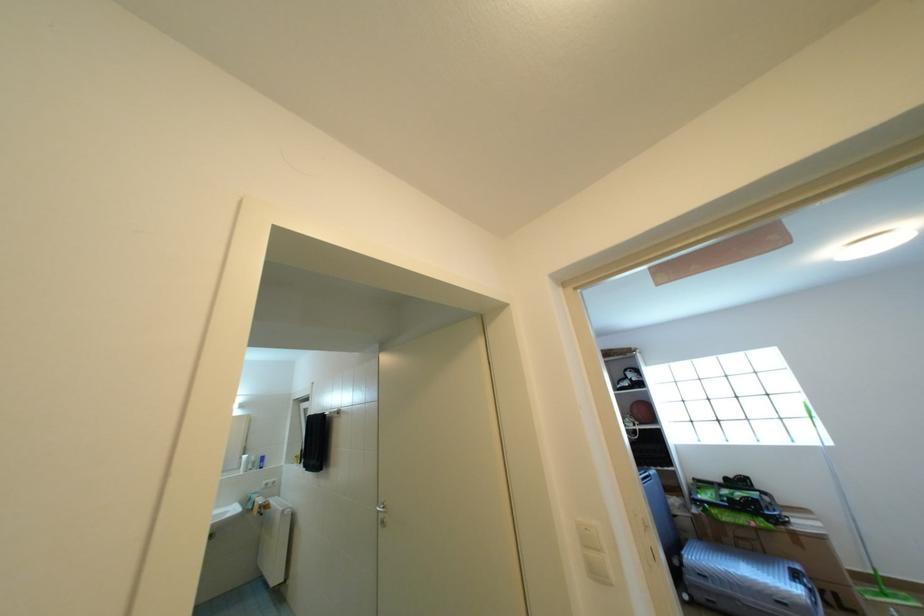
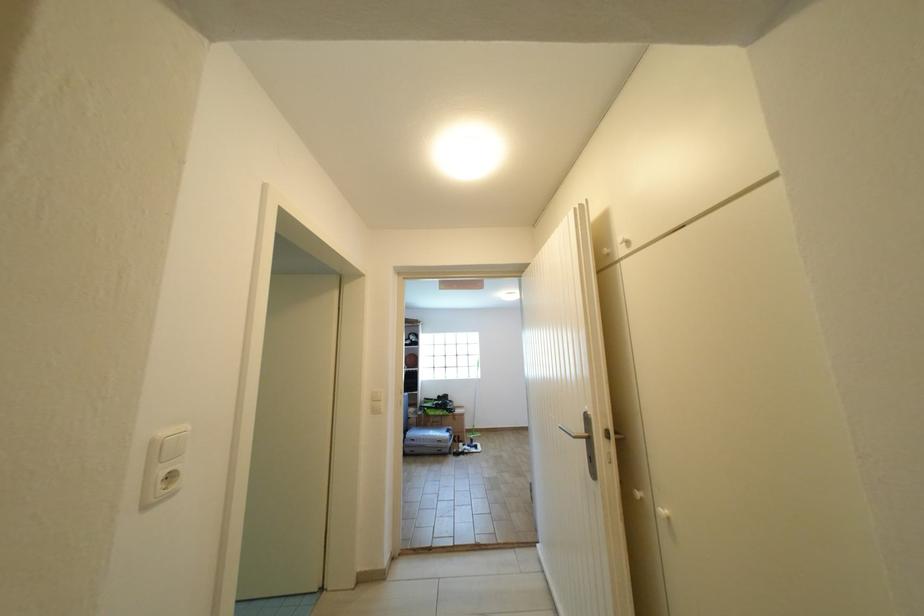
Question: The first image is from the beginning of the video and the second image is from the end. How did the camera likely rotate when shooting the video?

Choices:
 (A) Left
 (B) Right
 (C) Up
 (D) Down

Answer: (B)